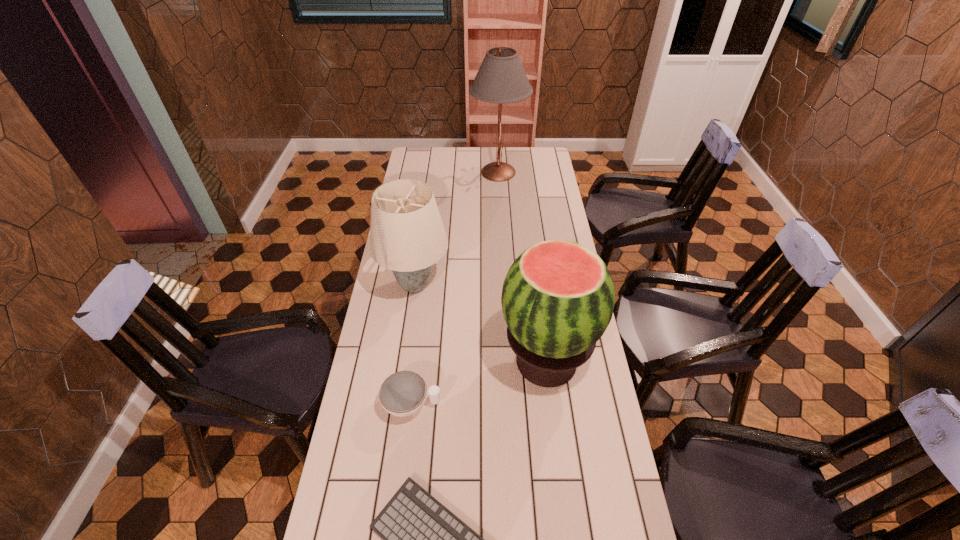
This screenshot has height=540, width=960. I want to click on vacant space located on the side with the handle of the chinaware, so click(x=569, y=404).

Where is `object located in the far edge section of the desktop`? object located in the far edge section of the desktop is located at coordinates [x=501, y=79].

Identify the location of lampshade present at the left edge. This screenshot has width=960, height=540. (407, 235).

Where is `chinaware situated at the left edge`? chinaware situated at the left edge is located at coordinates (403, 393).

Find the location of a particular element. The height and width of the screenshot is (540, 960). table lamp present at the right edge is located at coordinates (501, 79).

In order to click on watermelon that is at the right edge in this screenshot , I will do `click(558, 298)`.

Image resolution: width=960 pixels, height=540 pixels. Find the location of `object that is at the far right corner`. object that is at the far right corner is located at coordinates (501, 79).

This screenshot has width=960, height=540. What are the coordinates of `blank space at the far edge of the desktop` in the screenshot? It's located at (487, 147).

Find the location of `vacant space at the left edge of the desktop`. vacant space at the left edge of the desktop is located at coordinates (405, 325).

Identify the location of vacant point at the right edge. (611, 515).